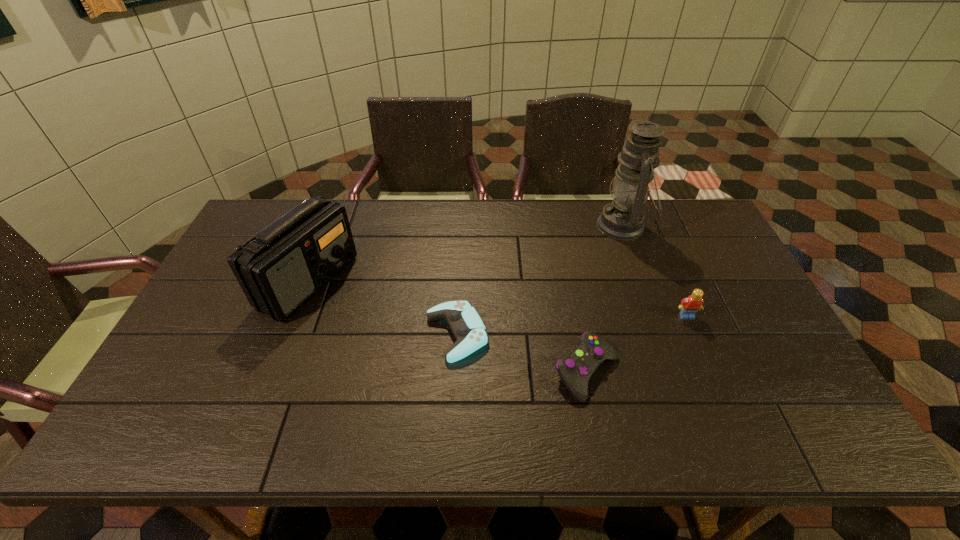
Where is `vacant area situated on the front-facing side of the third tallest object`? The image size is (960, 540). vacant area situated on the front-facing side of the third tallest object is located at coordinates (712, 376).

I want to click on free space located 0.060m on the left of the right control, so click(529, 372).

The width and height of the screenshot is (960, 540). Identify the location of free space located 0.060m on the front of the shorter control. (455, 384).

Locate an element on the screen. object at the far edge is located at coordinates (623, 219).

Where is `object at the left edge`? object at the left edge is located at coordinates click(x=279, y=269).

At what (x,y) coordinates should I click in order to perform the action: click on vacant region at the far edge of the desktop. Please return your answer as a coordinate pair (x, y). The image size is (960, 540). Looking at the image, I should click on (615, 241).

Where is `vacant region at the near edge`? Image resolution: width=960 pixels, height=540 pixels. vacant region at the near edge is located at coordinates (415, 413).

Find the location of `free space at the right edge`. free space at the right edge is located at coordinates (730, 330).

Where is `free region at the near left corner of the desktop`? Image resolution: width=960 pixels, height=540 pixels. free region at the near left corner of the desktop is located at coordinates (170, 423).

Locate an element on the screen. The height and width of the screenshot is (540, 960). free space between the third shortest object and the tallest object is located at coordinates (655, 271).